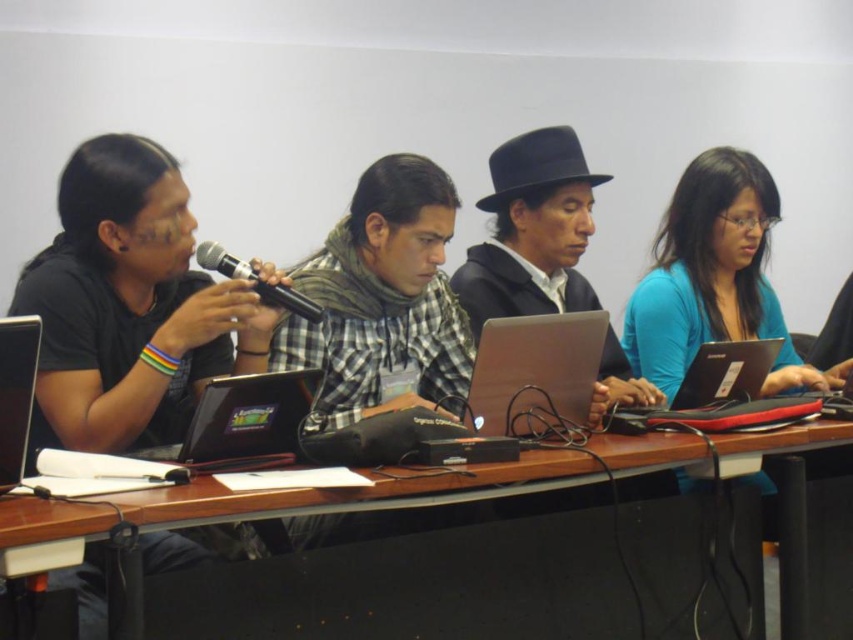
You are sitting at the long wooden table in the conference room. You need to reach a document placed at point A and another at point B. Point A is at coordinates point [305,426] and point B is at coordinates point [819,385]. Which point is closer to you?

Point A at coordinates point [305,426] is closer to you because it is in front of point B at coordinates point [819,385].

You are an interior designer observing the conference room scene. You need to determine which object is shorter between the checkered fabric scarf at center and the blue matte shirt at right. Which one is shorter?

The checkered fabric scarf at center has a lesser height compared to the blue matte shirt at right, so the checkered fabric scarf at center is shorter.